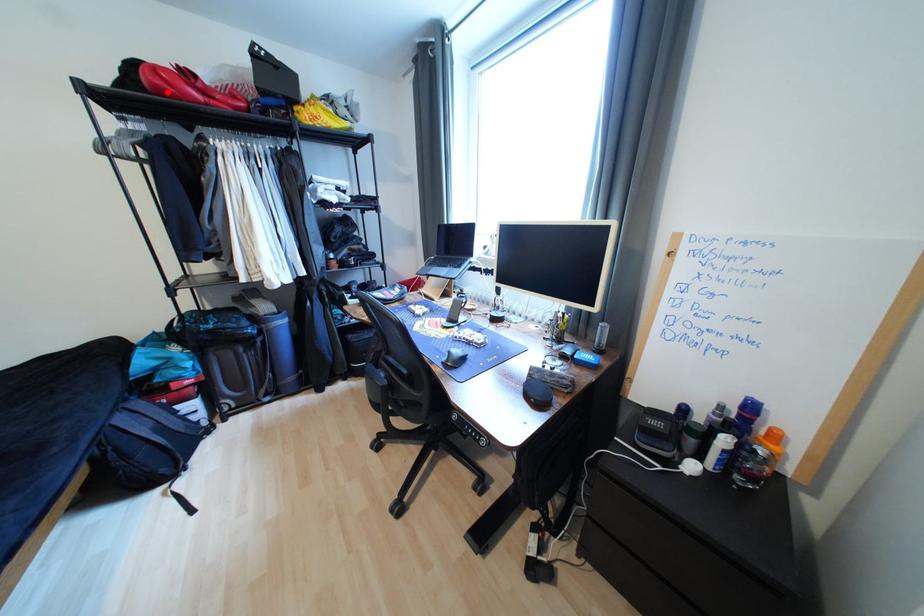
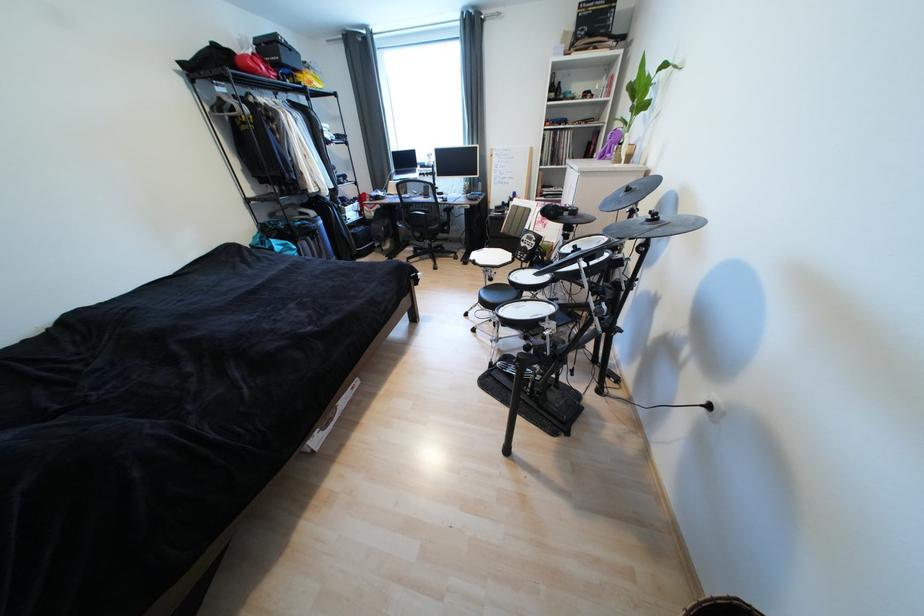
Find the pixel in the second image that matches the highlighted location in the first image.

(261, 73)